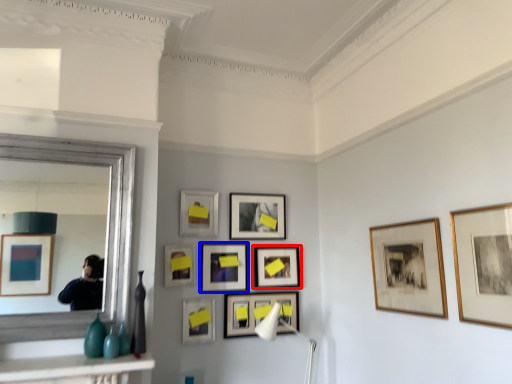
Question: Which object appears farthest to the camera in this image, picture frame (highlighted by a red box) or picture frame (highlighted by a blue box)?

Choices:
 (A) picture frame
 (B) picture frame

Answer: (A)